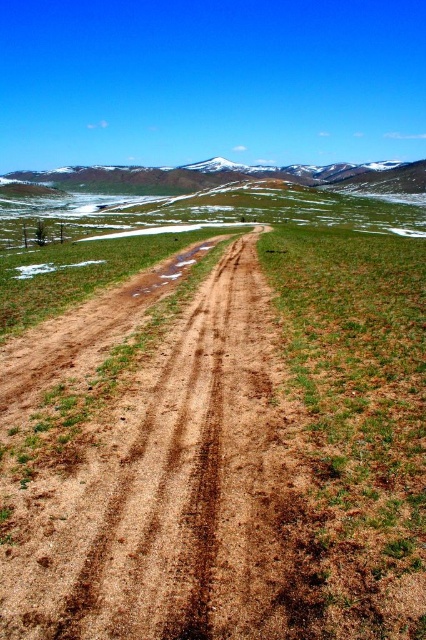
Based on the photo, does brown dirt road at center appear under snowy rocky mountain at upper center?

Indeed, brown dirt road at center is positioned under snowy rocky mountain at upper center.

Find the location of a particular element. brown dirt road at center is located at coordinates (222, 451).